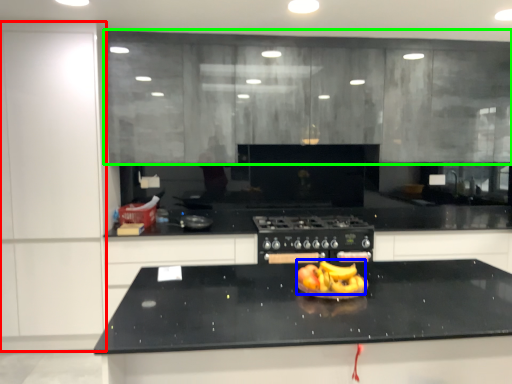
Question: Based on their relative distances, which object is farther from cabinetry (highlighted by a red box)? Choose from fruit dish (highlighted by a blue box) and cabinetry (highlighted by a green box).

Choices:
 (A) fruit dish
 (B) cabinetry

Answer: (A)